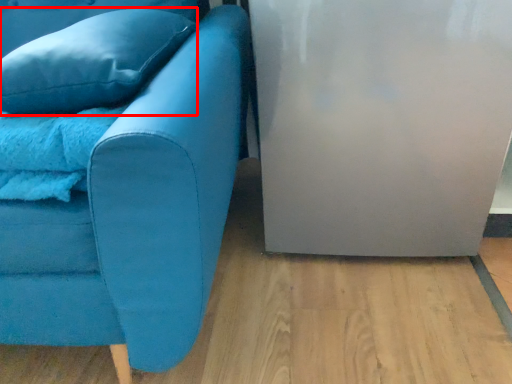
Question: Where is pillow (annotated by the red box) located in relation to studio couch in the image?

Choices:
 (A) right
 (B) left

Answer: (A)